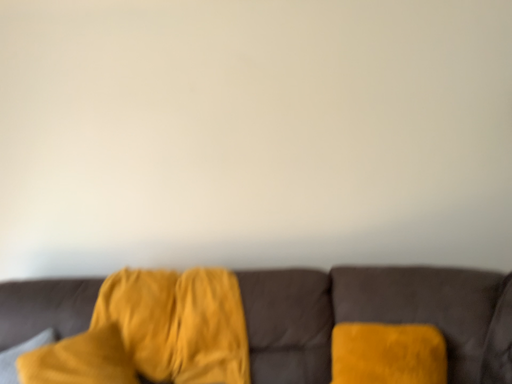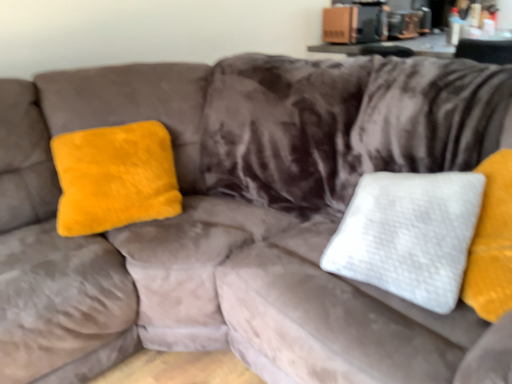
Question: Which way did the camera rotate in the video?

Choices:
 (A) rotated left
 (B) rotated right

Answer: (B)